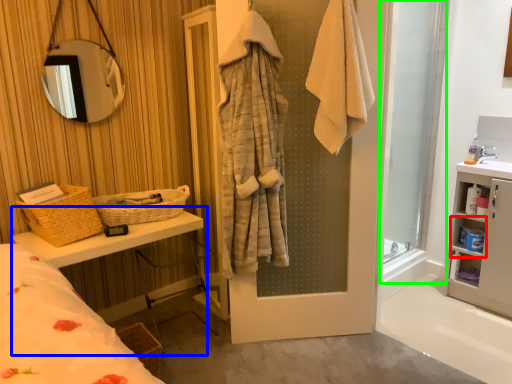
Question: Based on their relative distances, which object is farther from cabinet (highlighted by a red box)? Choose from vanity (highlighted by a blue box) and screen door (highlighted by a green box).

Choices:
 (A) vanity
 (B) screen door

Answer: (A)